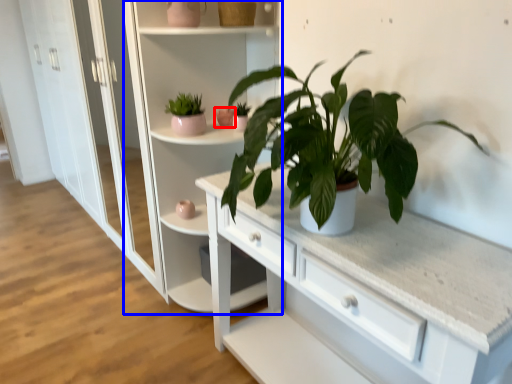
Question: Which object appears farthest to the camera in this image, flowerpot (highlighted by a red box) or bookshelf (highlighted by a blue box)?

Choices:
 (A) flowerpot
 (B) bookshelf

Answer: (A)